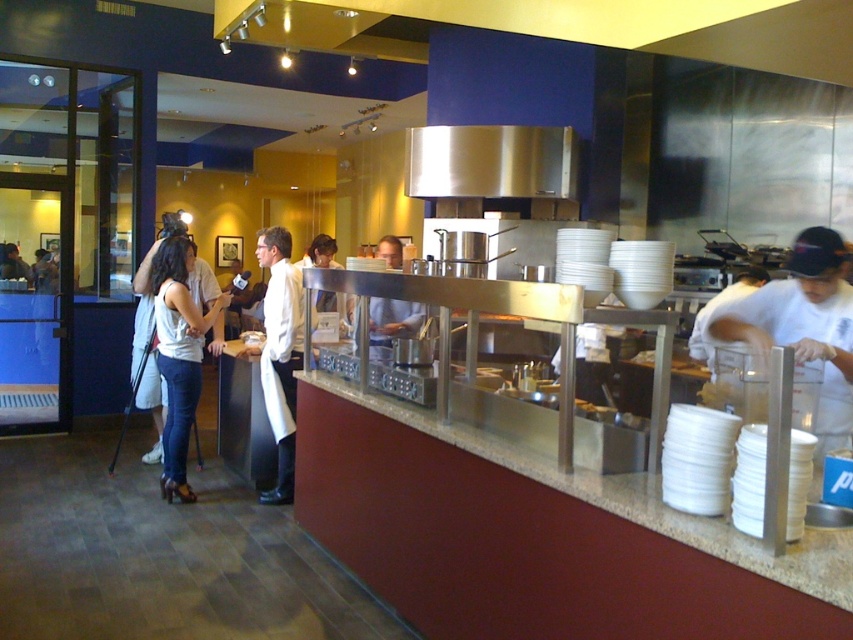
Find the location of a particular element. marble countertop at center is located at coordinates [538, 538].

Which is below, marble countertop at center or white matte chef coat at center?

marble countertop at center is lower down.

Find the location of a particular element. marble countertop at center is located at coordinates (538, 538).

Which of these two, white matte chef coat at center or white chef coat at center, stands taller?

Standing taller between the two is white matte chef coat at center.

Is white matte chef coat at center taller than white chef coat at center?

Yes.

Who is more forward, (282, 465) or (393, 266)?

Positioned in front is point (282, 465).

Identify the location of white matte chef coat at center. (280, 353).

Which is below, white matte shirt at right or matte white blouse at center?

→ matte white blouse at center is lower down.

Does white matte shirt at right lie behind matte white blouse at center?

No.

Is point (836, 397) positioned behind point (178, 294)?

That is False.

Image resolution: width=853 pixels, height=640 pixels. What are the coordinates of `white matte shirt at right` in the screenshot? It's located at (804, 324).